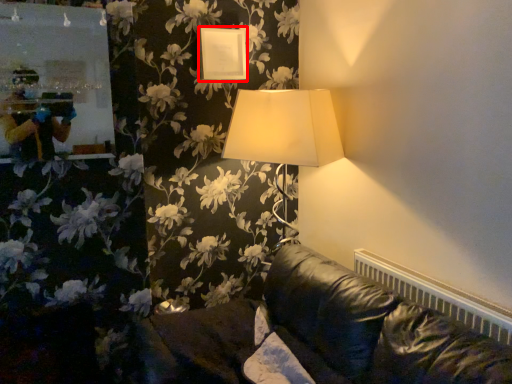
Question: Observing the image, what is the correct spatial positioning of picture frame (annotated by the red box) in reference to radiator?

Choices:
 (A) left
 (B) right

Answer: (A)